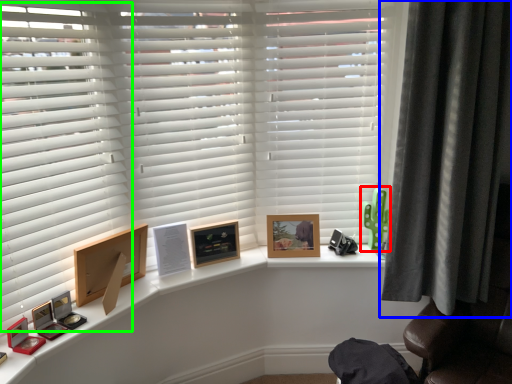
Question: Considering the real-world distances, which object is closest to toy (highlighted by a red box)? curtain (highlighted by a blue box) or shutter (highlighted by a green box).

Choices:
 (A) curtain
 (B) shutter

Answer: (A)